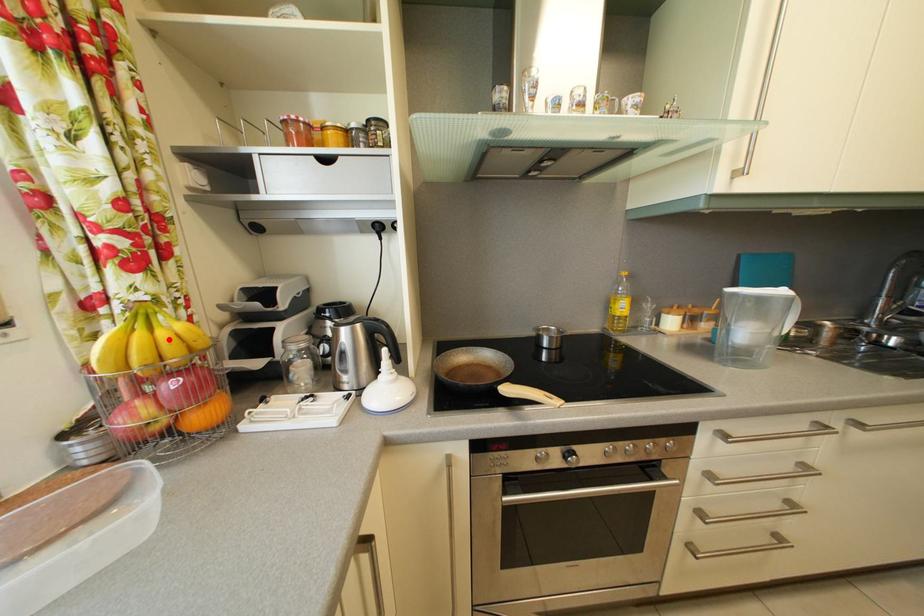
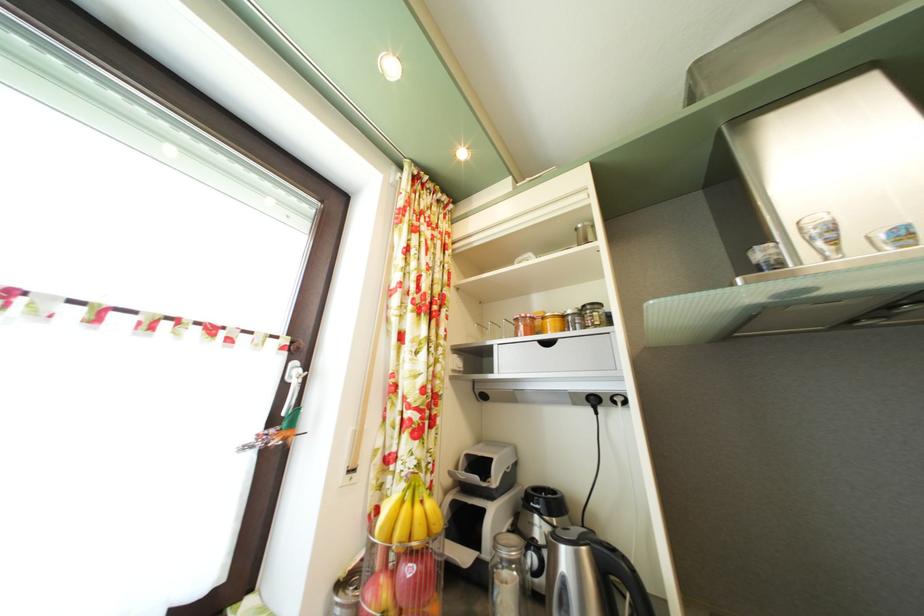
Locate, in the second image, the point that corresponds to the highlighted location in the first image.

(426, 516)